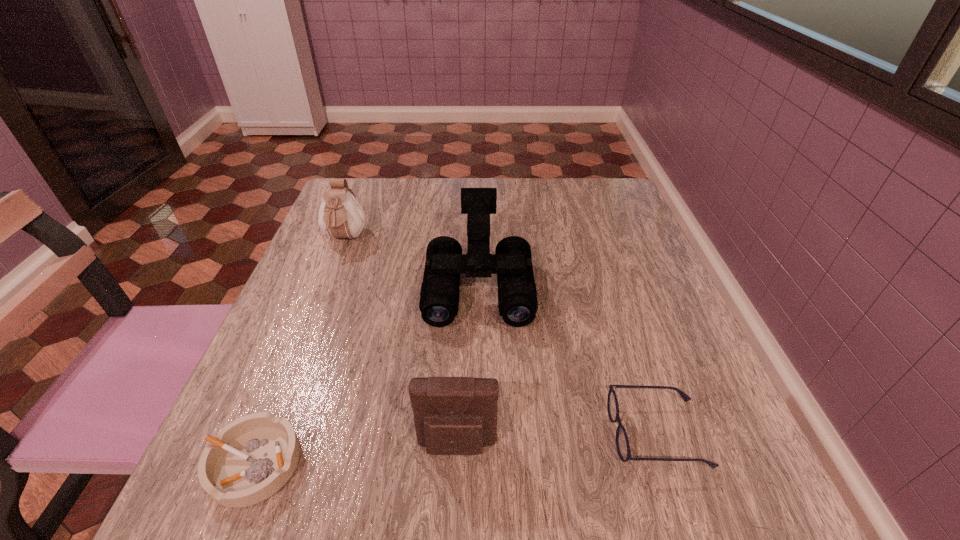
At what (x,y) coordinates should I click in order to perform the action: click on vacant space positioned 0.230m on the front-facing side of the fourth tallest object. Please return your answer as a coordinate pair (x, y). The height and width of the screenshot is (540, 960). Looking at the image, I should click on [463, 433].

Identify the location of free region located 0.360m on the back of the ashtray. The width and height of the screenshot is (960, 540). (328, 274).

Locate an element on the screen. This screenshot has width=960, height=540. object that is at the far edge is located at coordinates (340, 215).

The width and height of the screenshot is (960, 540). In order to click on spectacles that is at the near edge in this screenshot , I will do `click(622, 443)`.

Image resolution: width=960 pixels, height=540 pixels. Identify the location of ashtray located at the near edge. (254, 456).

Locate an element on the screen. pouch present at the left edge is located at coordinates tap(340, 215).

Locate an element on the screen. This screenshot has width=960, height=540. ashtray positioned at the left edge is located at coordinates (254, 456).

This screenshot has width=960, height=540. Identify the location of object positioned at the right edge. 622,443.

Identify the location of object located at the far left corner. The width and height of the screenshot is (960, 540). (340, 215).

Identify the location of object that is at the near left corner. (254, 456).